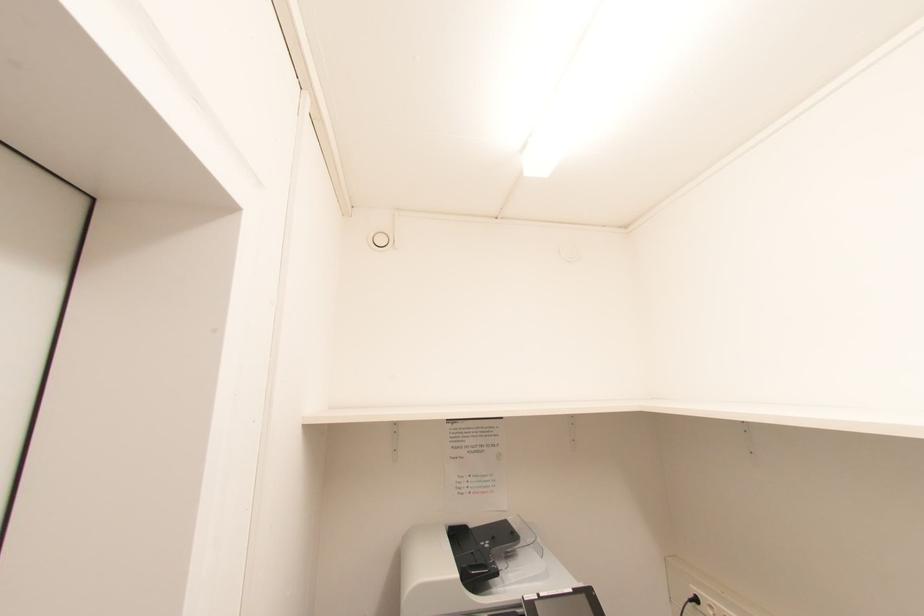
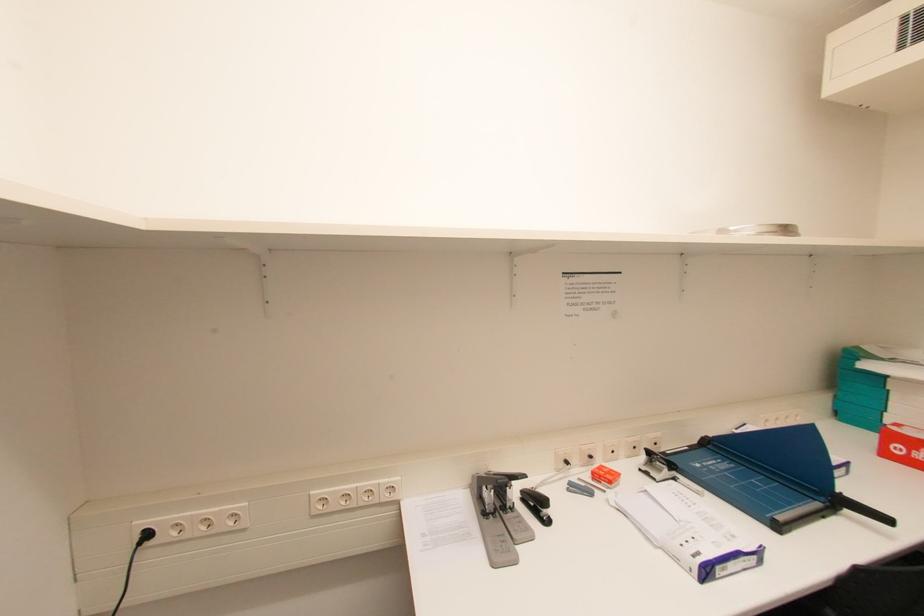
Question: The camera is either moving clockwise (left) or counter-clockwise (right) around the object. The first image is from the beginning of the video and the second image is from the end. Is the camera moving left or right when shooting the video?

Choices:
 (A) Left
 (B) Right

Answer: (A)